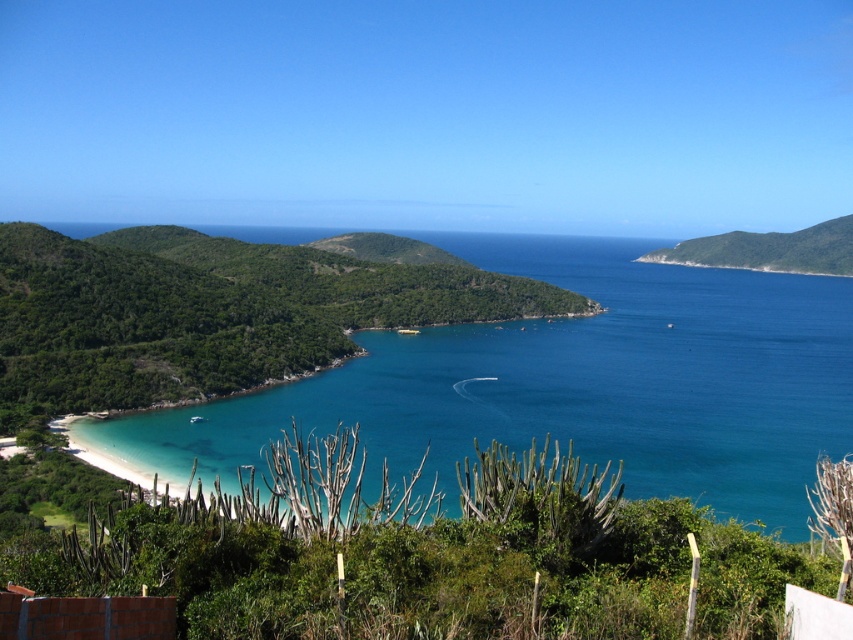
Question: Which point is farther to the camera?

Choices:
 (A) green leafy hill at lower left
 (B) green leafy hill at upper right

Answer: (B)

Question: Observing the image, what is the correct spatial positioning of clear blue water at lower left in reference to green leafy hill at upper right?

Choices:
 (A) right
 (B) left

Answer: (B)

Question: Which of the following is the closest to the observer?

Choices:
 (A) (802, 237)
 (B) (531, 320)
 (C) (117, 284)

Answer: (C)

Question: Can you confirm if clear blue water at lower left is bigger than green leafy hill at upper right?

Choices:
 (A) no
 (B) yes

Answer: (B)

Question: Which point is closer to the camera taking this photo?

Choices:
 (A) (492, 288)
 (B) (537, 275)
 (C) (807, 244)

Answer: (A)

Question: Does green leafy hill at lower left appear over green leafy hill at upper right?

Choices:
 (A) yes
 (B) no

Answer: (B)